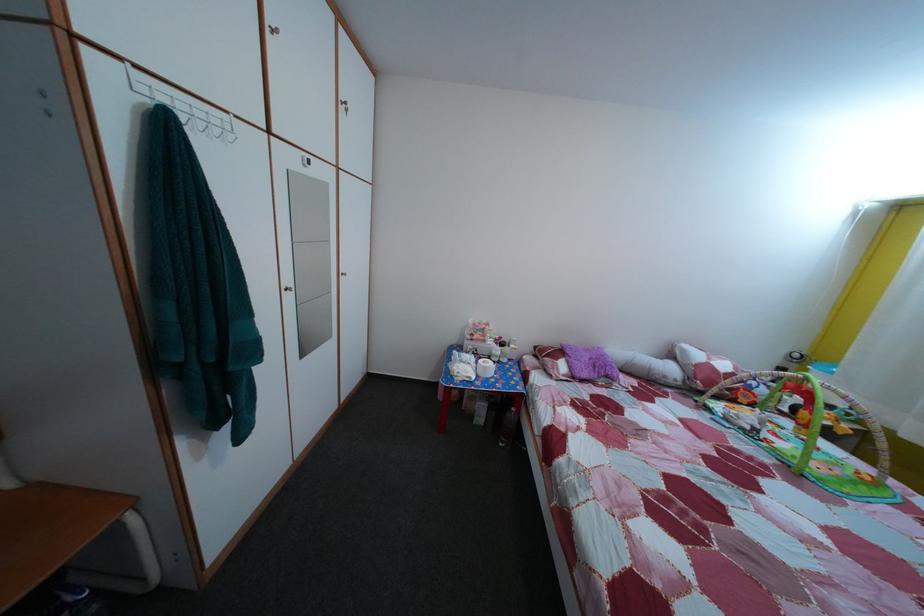
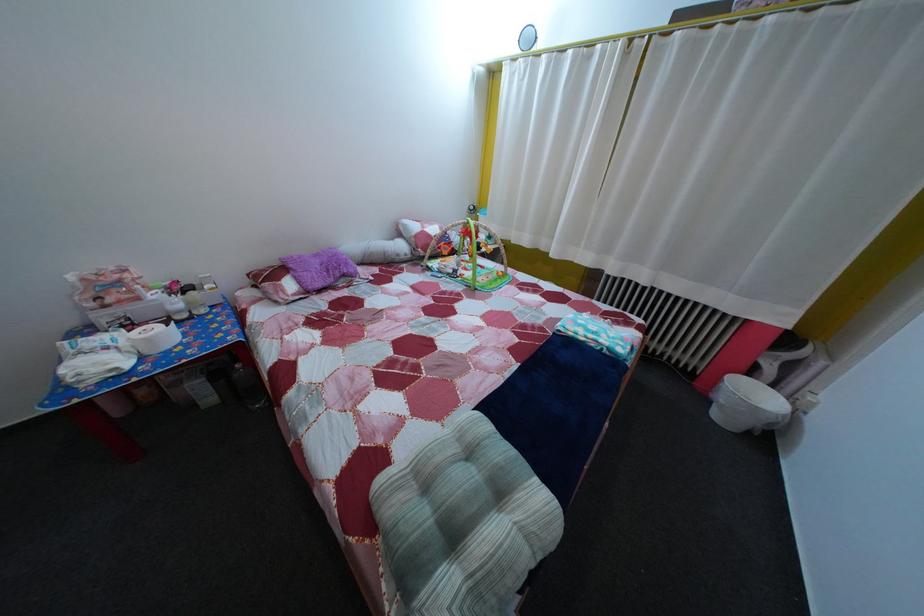
Locate, in the second image, the point that corresponds to point (752, 408) in the first image.

(455, 261)